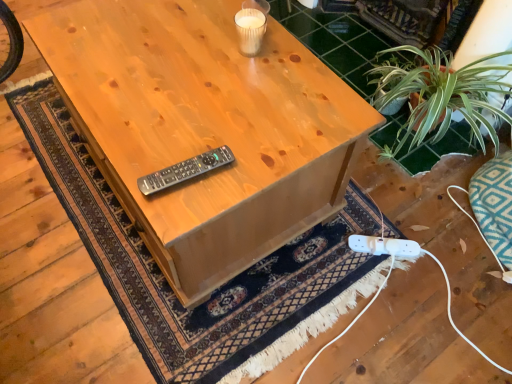
In order to click on free spot above natural wood table at center (from a real-world perspective) in this screenshot , I will do [185, 98].